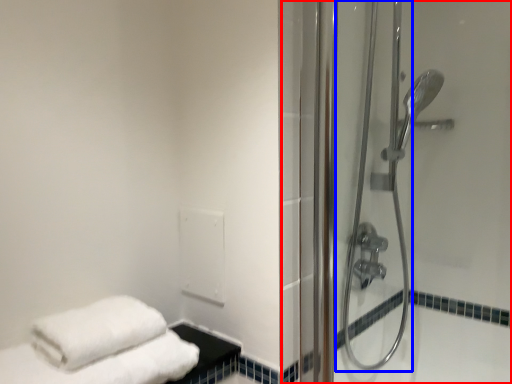
Question: Which point is closer to the camera, shower door (highlighted by a red box) or shower door (highlighted by a blue box)?

Choices:
 (A) shower door
 (B) shower door

Answer: (A)